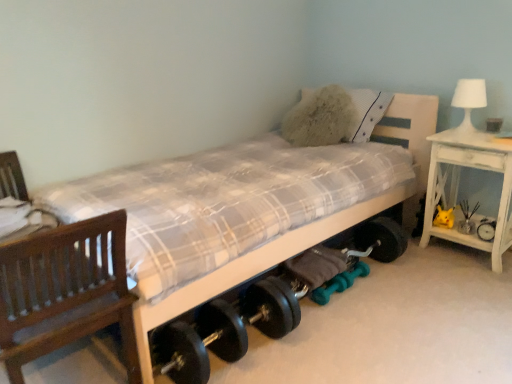
Locate an element on the screen. empty space that is ontop of white distressed wood nightstand at right (from a real-world perspective) is located at coordinates (481, 138).